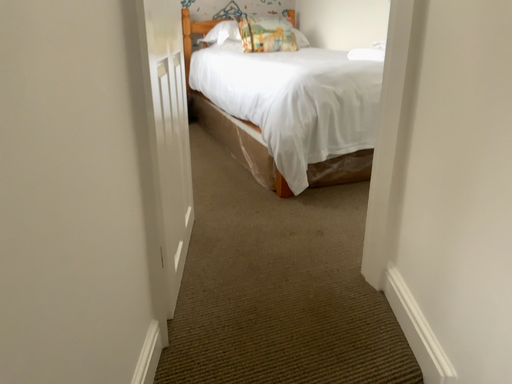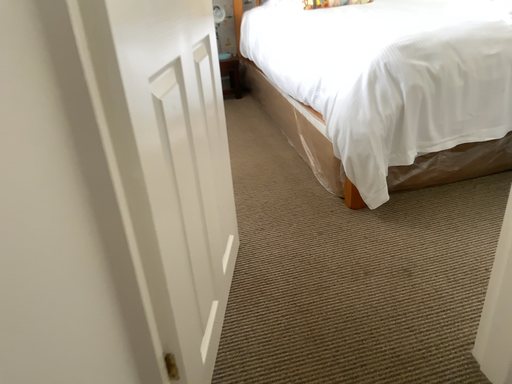
Question: How did the camera likely rotate when shooting the video?

Choices:
 (A) rotated downward
 (B) rotated upward

Answer: (A)